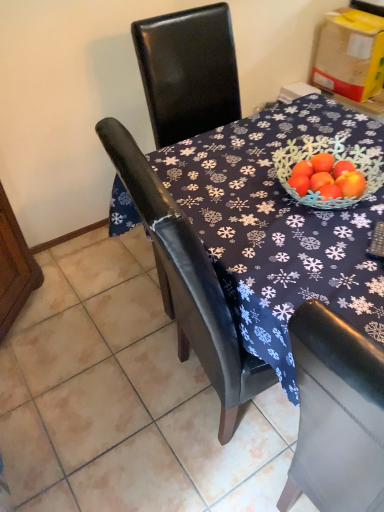
The image size is (384, 512). I want to click on blank space above matte black chair at center (from a real-world perspective), so click(x=116, y=361).